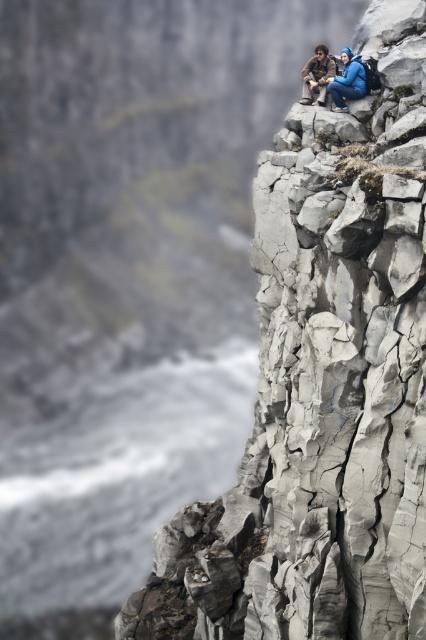
You are a photographer planning to capture a landscape shot of the cliff scene. You want to ensure the gray cracked rock at upper center and the blue fabric jacket at upper center are both visible in the frame. Given their sizes, which object should you prioritize keeping in focus to ensure both are adequately captured?

The gray cracked rock at upper center has a greater height compared to the blue fabric jacket at upper center. Since the rock is larger, it would require more focus to capture its details, so prioritize keeping the gray cracked rock at upper center in focus to ensure both are adequately captured.

You are a hiker who wants to place a small emergency beacon on the cliff edge. The beacon requires a flat surface at least 0.5 meters wide. Can the point at coordinates point (336, 77) accommodate the beacon?

The point at coordinates point (336, 77) has blue fabric jacket at upper center, so it cannot accommodate the beacon as the surface is occupied by the jacket.

You are a photographer positioned at the base of the cliff, aiming to capture a clear photo of both the blue fabric jacket at upper center and the brown leather jacket at upper center. Considering their positions, which jacket will appear smaller in the photo?

The blue fabric jacket at upper center will appear smaller in the photo because it has a lesser height compared to the brown leather jacket at upper center.